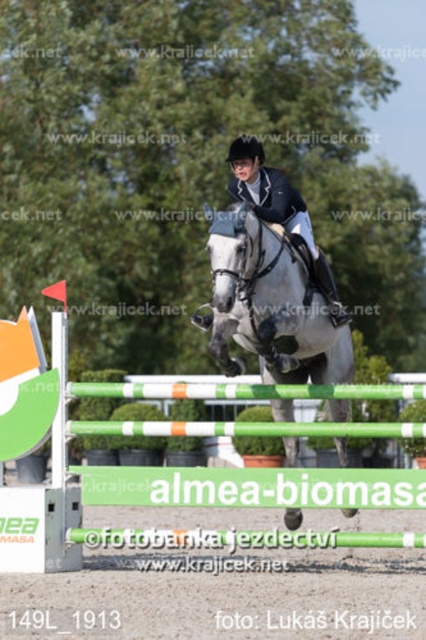
You are a photographer positioned at the camera. You want to capture a closeup shot of the point at coordinates (x=328, y=488). Given that you are 32.63 feet away from the point, can you estimate whether you can get a clear closeup without moving closer?

The point at coordinates (x=328, y=488) is 32.63 feet away from the camera. To capture a clear closeup, you would need to either move closer or use a telephoto lens capable of zooming sufficiently from that distance.

Based on the photo, you are a judge at the show jumping event. You need to ensure that the green plastic hurdle at center is higher than the white glossy horse at center to qualify for the next round. Based on the current setup, will the horse clear the hurdle?

The green plastic hurdle at center is not as tall as white glossy horse at center, so the horse will easily clear the hurdle. However, since the hurdle is shorter than required, the setup does not meet the qualification criteria for the next round.

You are a judge observing the equestrian show jumping event. You need to determine if the rider and horse are positioned correctly relative to the two points marked in the image. Specifically, is the point at coordinates point (198, 428) located behind the point at coordinates point (282, 364) from your viewpoint?

Based on the spatial relationship provided, point (198, 428) is indeed positioned behind point (282, 364) from the judge s perspective, confirming the correct positioning.